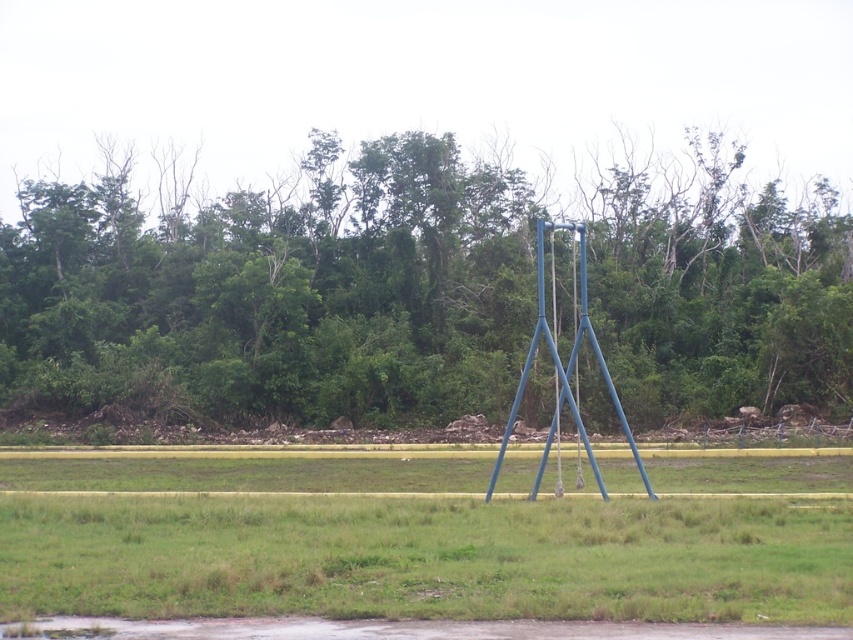
You are standing in the middle of the grassy area and want to walk towards the blue metallic swing set at center. Which direction should you walk to avoid the green leafy trees at center?

The green leafy trees at center are to the left of the blue metallic swing set at center. To avoid them, you should walk towards the right side of the blue metallic swing set at center.

You are planning to take a photo of the blue metallic swing set at center and the green leafy trees at center. Which object should you focus on if you want the other to appear smaller in the background?

To have the green leafy trees at center appear smaller in the background, focus on the blue metallic swing set at center since the trees are larger and would naturally recede in size when the swing set is the main focus.

You are planning to install a new garden bed between the green leafy trees at center and the blue metallic swing set at center. The garden bed requires a minimum of 150 feet of space. Based on the scene, is there enough space between them to accommodate the garden bed?

The distance between the green leafy trees at center and the blue metallic swing set at center is 140.58 feet, which is less than the required 150 feet. Therefore, there is not enough space to install the garden bed between them.